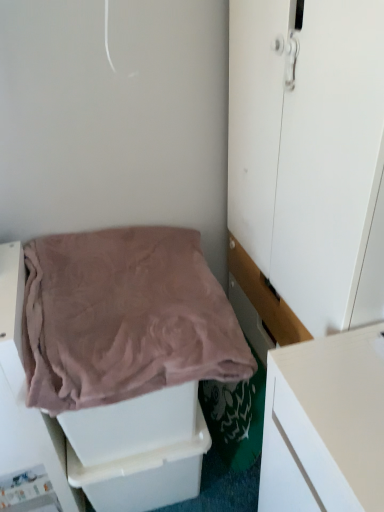
Question: Which is correct: white plastic drawer at lower center is inside pink soft fabric at lower left, or outside of it?

Choices:
 (A) inside
 (B) outside

Answer: (B)

Question: From the image's perspective, is white plastic drawer at lower center located above or below pink soft fabric at lower left?

Choices:
 (A) above
 (B) below

Answer: (B)

Question: Which object is the farthest from the white plastic drawer at lower center?

Choices:
 (A) white matte door at center
 (B) pink soft fabric at lower left

Answer: (A)

Question: Which is nearer to the white matte door at center?

Choices:
 (A) pink soft fabric at lower left
 (B) white plastic drawer at lower center

Answer: (A)